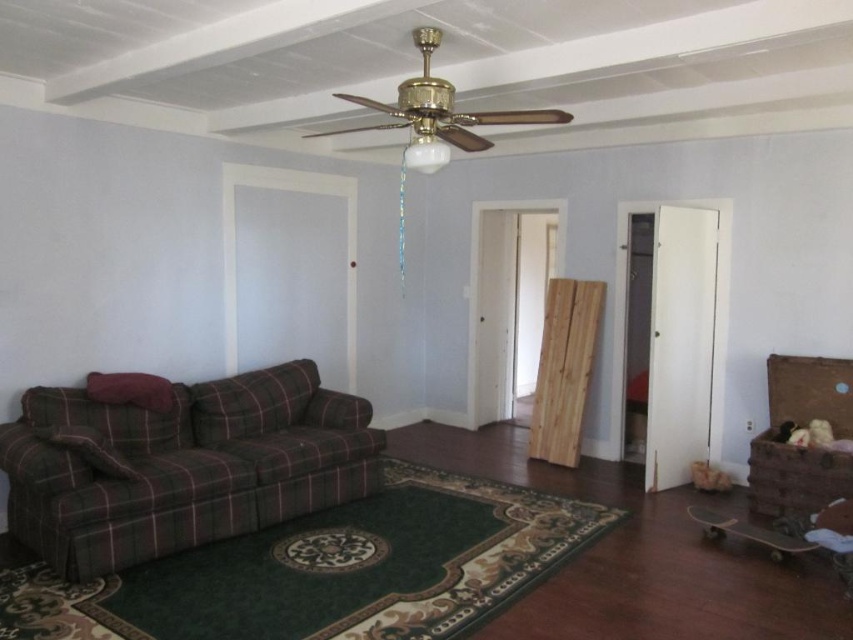
Question: Can you confirm if plaid fabric couch at lower left is positioned above brown wicker chest at right?

Choices:
 (A) yes
 (B) no

Answer: (B)

Question: Does plaid fabric couch at lower left come behind brown wicker chest at right?

Choices:
 (A) yes
 (B) no

Answer: (B)

Question: In this image, where is plaid fabric couch at lower left located relative to brown wicker chest at right?

Choices:
 (A) left
 (B) right

Answer: (A)

Question: Which point appears closest to the camera in this image?

Choices:
 (A) (343, 474)
 (B) (843, 388)

Answer: (A)